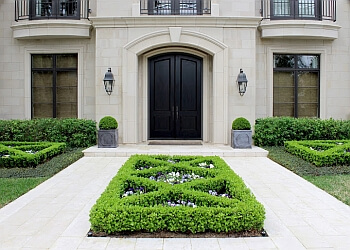
At what (x,y) coordinates should I click in order to perform the action: click on door mat. Please return your answer as a coordinate pair (x, y). This screenshot has height=250, width=350. Looking at the image, I should click on (174, 142).